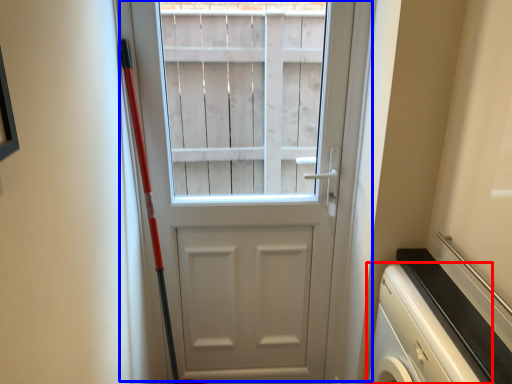
Question: Which object appears farthest to the camera in this image, dish washer (highlighted by a red box) or door (highlighted by a blue box)?

Choices:
 (A) dish washer
 (B) door

Answer: (B)